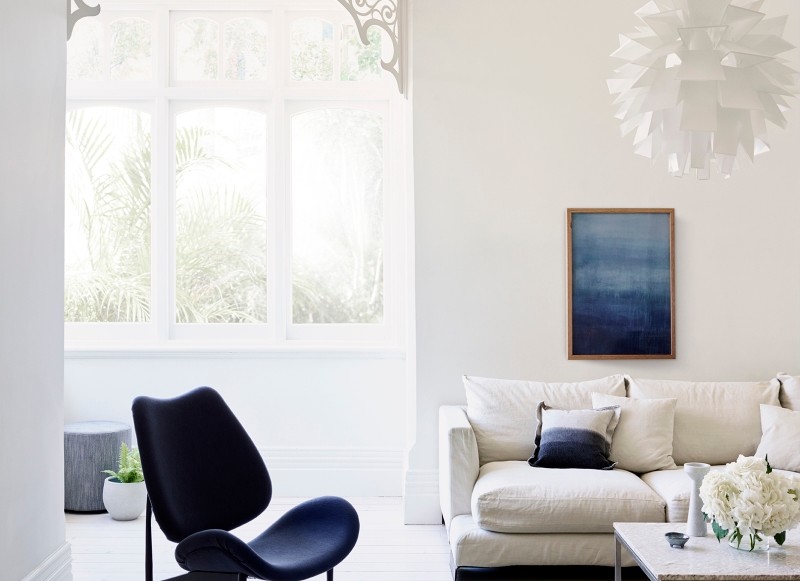
I want to click on table, so click(678, 553).